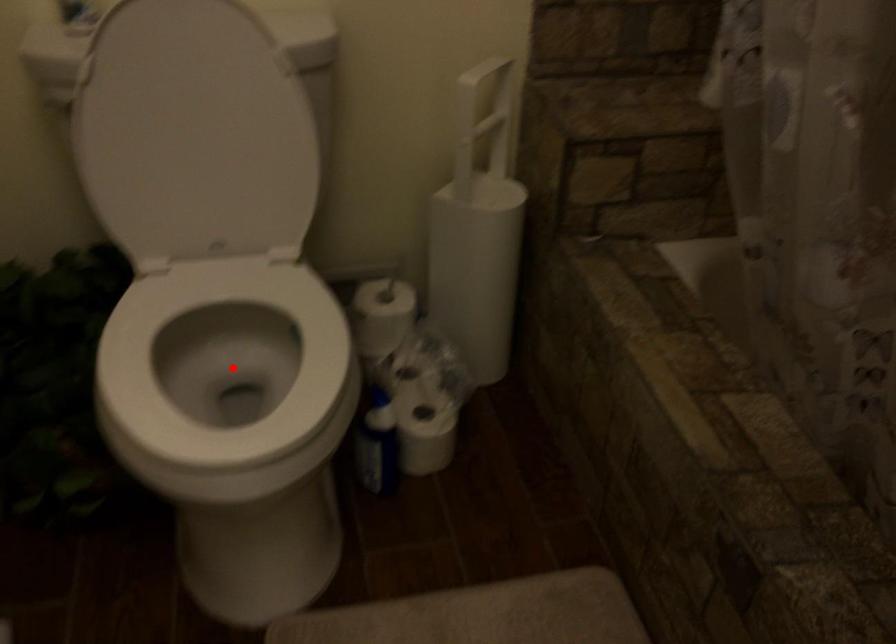
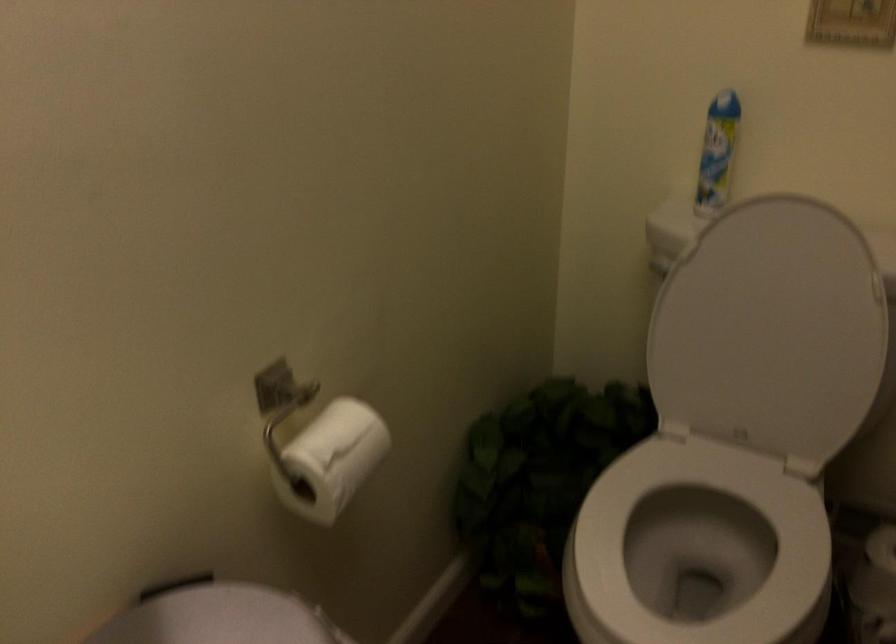
Find the pixel in the second image that matches the highlighted location in the first image.

(698, 547)